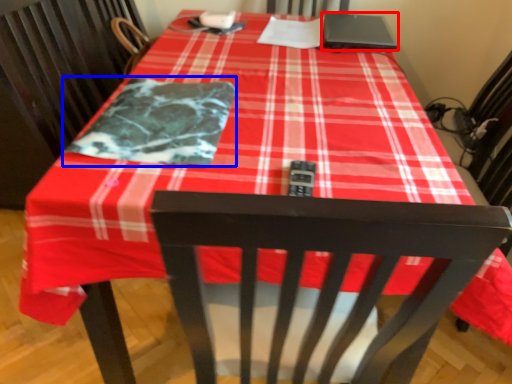
Question: Which object appears closest to the camera in this image, laptop (highlighted by a red box) or blanket (highlighted by a blue box)?

Choices:
 (A) laptop
 (B) blanket

Answer: (B)